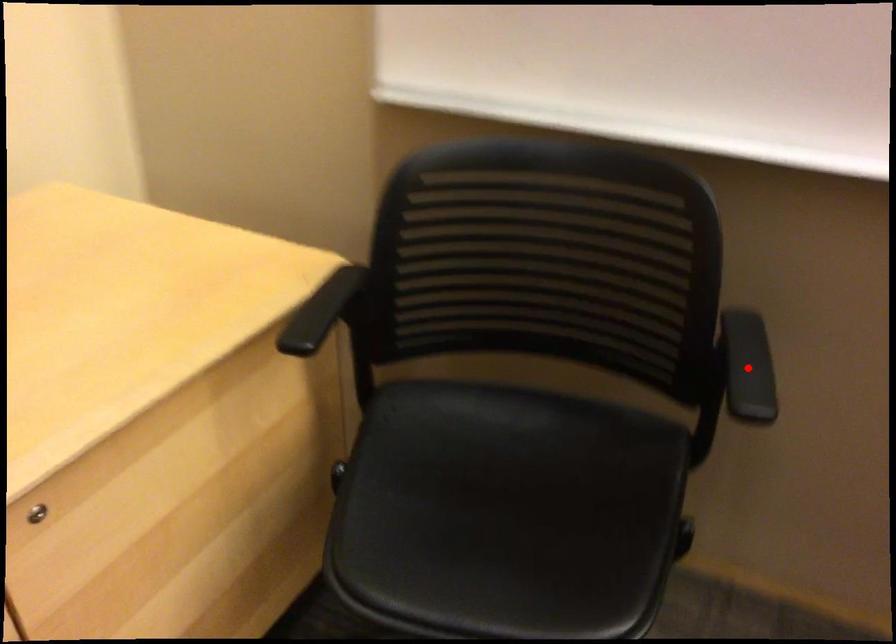
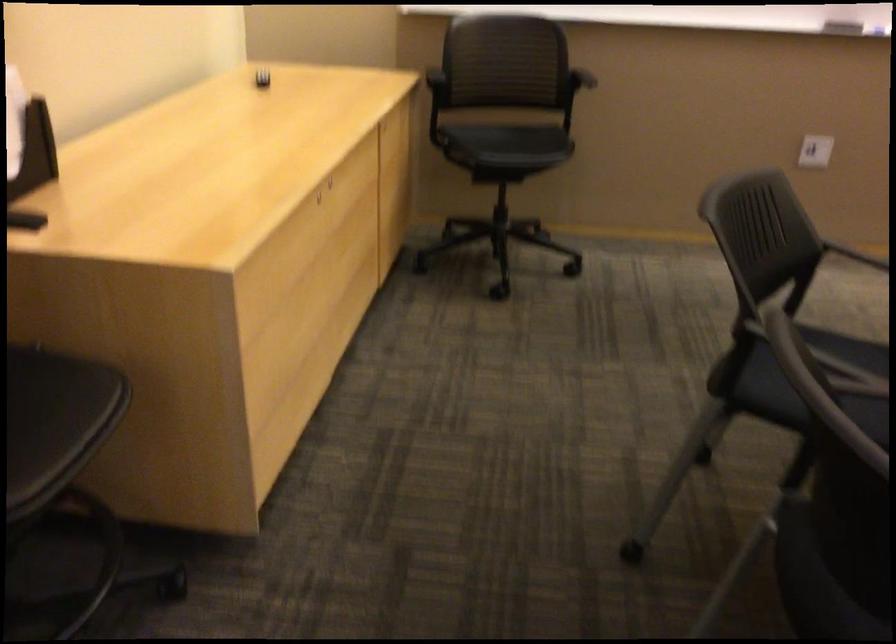
In the second image, find the point that corresponds to the highlighted location in the first image.

(589, 89)